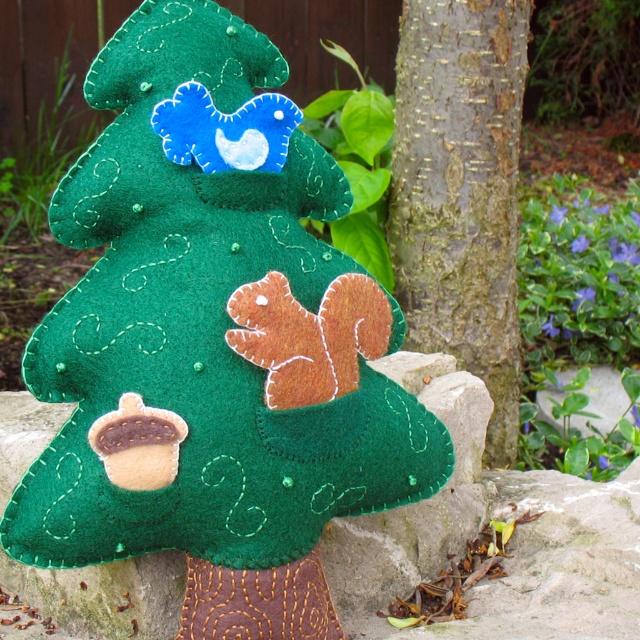
Can you confirm if felt squirrel at center is smaller than rough bark tree trunk at center?

No.

The image size is (640, 640). Describe the element at coordinates (212, 340) in the screenshot. I see `felt squirrel at center` at that location.

At what (x,y) coordinates should I click in order to perform the action: click on felt squirrel at center. Please return your answer as a coordinate pair (x, y). This screenshot has height=640, width=640. Looking at the image, I should click on click(212, 340).